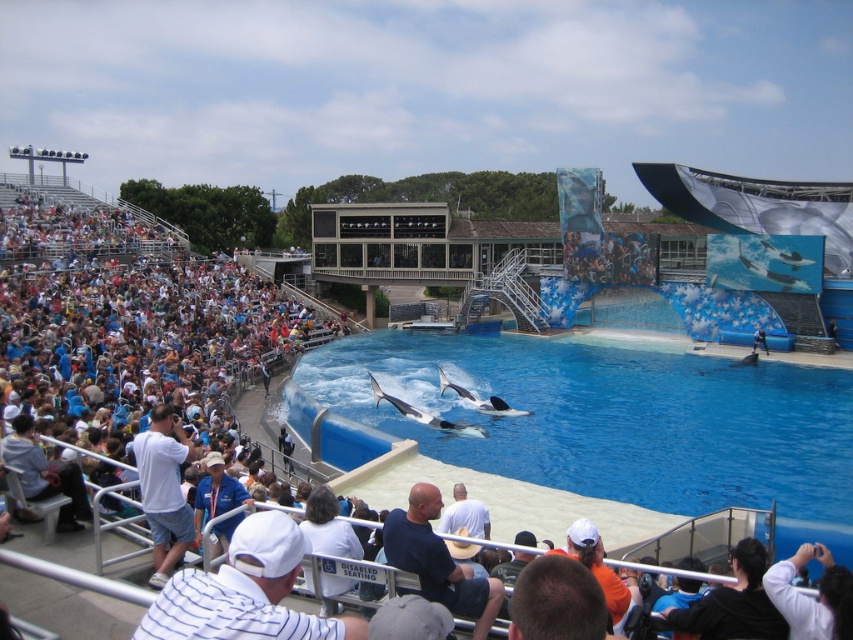
Question: Can you confirm if white smooth whale at center is smaller than white smooth dolphin at center?

Choices:
 (A) yes
 (B) no

Answer: (B)

Question: Among these points, which one is nearest to the camera?

Choices:
 (A) (584, 557)
 (B) (210, 483)
 (C) (799, 627)

Answer: (C)

Question: Which point is farther from the camera taking this photo?

Choices:
 (A) (602, 404)
 (B) (779, 605)
 (C) (744, 554)
 (D) (323, 490)

Answer: (A)

Question: Estimate the real-world distances between objects in this image. Which object is farther from the black fabric at lower right?

Choices:
 (A) white fabric camera at lower right
 (B) white cotton shirt at center

Answer: (B)

Question: Can you confirm if dark blue shirt at lower center is positioned to the left of white cotton shirt at center?

Choices:
 (A) yes
 (B) no

Answer: (B)

Question: Is black fabric at lower right above orange t-shirt at lower center?

Choices:
 (A) no
 (B) yes

Answer: (B)